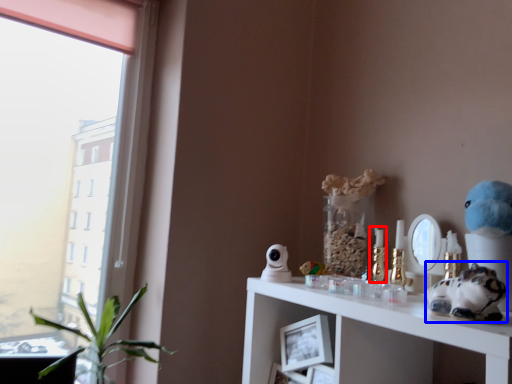
Question: Which point is closer to the camera, candle holder (highlighted by a red box) or toy (highlighted by a blue box)?

Choices:
 (A) candle holder
 (B) toy

Answer: (B)